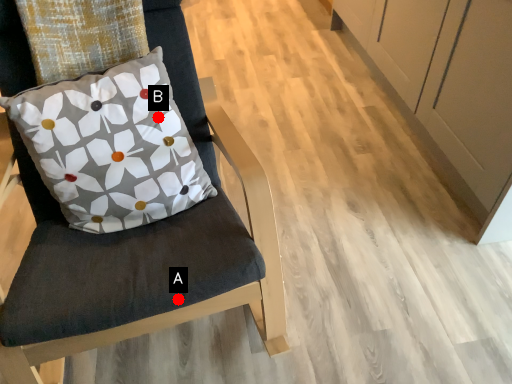
Question: Two points are circled on the image, labeled by A and B beside each circle. Which point is closer to the camera?

Choices:
 (A) A is closer
 (B) B is closer

Answer: (A)